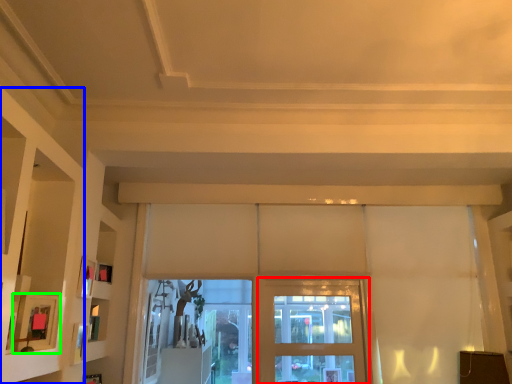
Question: Based on their relative distances, which object is farther from screen door (highlighted by a red box)? Choose from shelf (highlighted by a blue box) and picture frame (highlighted by a green box).

Choices:
 (A) shelf
 (B) picture frame

Answer: (A)